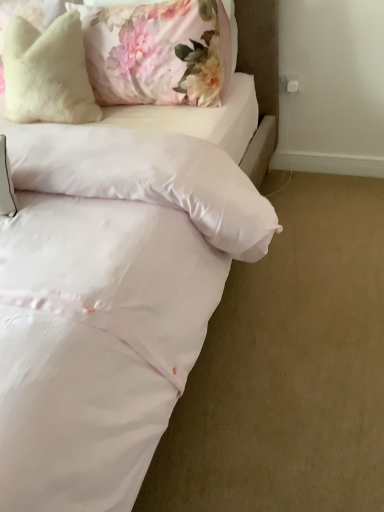
Question: Is fluffy white pillow at upper left, marked as the second pillow in a left-to-right arrangement, positioned behind white satin bed at center?

Choices:
 (A) no
 (B) yes

Answer: (B)

Question: Would you say fluffy white pillow at upper left, marked as the second pillow in a left-to-right arrangement, is outside white satin bed at center?

Choices:
 (A) yes
 (B) no

Answer: (B)

Question: Is fluffy white pillow at upper left, marked as the second pillow in a left-to-right arrangement, facing towards white satin bed at center?

Choices:
 (A) yes
 (B) no

Answer: (A)

Question: From the image's perspective, is fluffy white pillow at upper left, marked as the second pillow in a left-to-right arrangement, on white satin bed at center?

Choices:
 (A) yes
 (B) no

Answer: (A)

Question: From the image's perspective, is fluffy white pillow at upper left, marked as the second pillow in a left-to-right arrangement, located beneath white satin bed at center?

Choices:
 (A) no
 (B) yes

Answer: (A)

Question: Relative to white satin bed at center, is fluffy white pillow at upper left, marked as the second pillow in a left-to-right arrangement, in front or behind?

Choices:
 (A) front
 (B) behind

Answer: (B)

Question: Would you say fluffy white pillow at upper left, the 1th pillow positioned from the right, is to the left or to the right of white satin bed at center in the picture?

Choices:
 (A) left
 (B) right

Answer: (B)

Question: Based on their sizes in the image, would you say fluffy white pillow at upper left, marked as the second pillow in a left-to-right arrangement, is bigger or smaller than white satin bed at center?

Choices:
 (A) big
 (B) small

Answer: (B)

Question: Is fluffy white pillow at upper left, marked as the second pillow in a left-to-right arrangement, taller or shorter than white satin bed at center?

Choices:
 (A) tall
 (B) short

Answer: (B)

Question: From a real-world perspective, is white satin bed at center physically located above or below fluffy white pillow at upper left, the 1th pillow positioned from the right?

Choices:
 (A) below
 (B) above

Answer: (A)

Question: Looking at their shapes, would you say white satin bed at center is wider or thinner than fluffy white pillow at upper left, marked as the second pillow in a left-to-right arrangement?

Choices:
 (A) thin
 (B) wide

Answer: (B)

Question: In the image, is white satin bed at center on the left side or the right side of fluffy white pillow at upper left, the 1th pillow positioned from the right?

Choices:
 (A) left
 (B) right

Answer: (A)

Question: Is white satin bed at center situated inside fluffy white pillow at upper left, the 1th pillow positioned from the right, or outside?

Choices:
 (A) inside
 (B) outside

Answer: (B)

Question: From the image's perspective, is fluffy white pillow at upper left, arranged as the 1th pillow when viewed from the left, located above or below fluffy white pillow at upper left, marked as the second pillow in a left-to-right arrangement?

Choices:
 (A) below
 (B) above

Answer: (A)

Question: Is fluffy white pillow at upper left, placed as the 2th pillow when sorted from right to left, situated inside fluffy white pillow at upper left, marked as the second pillow in a left-to-right arrangement, or outside?

Choices:
 (A) inside
 (B) outside

Answer: (A)